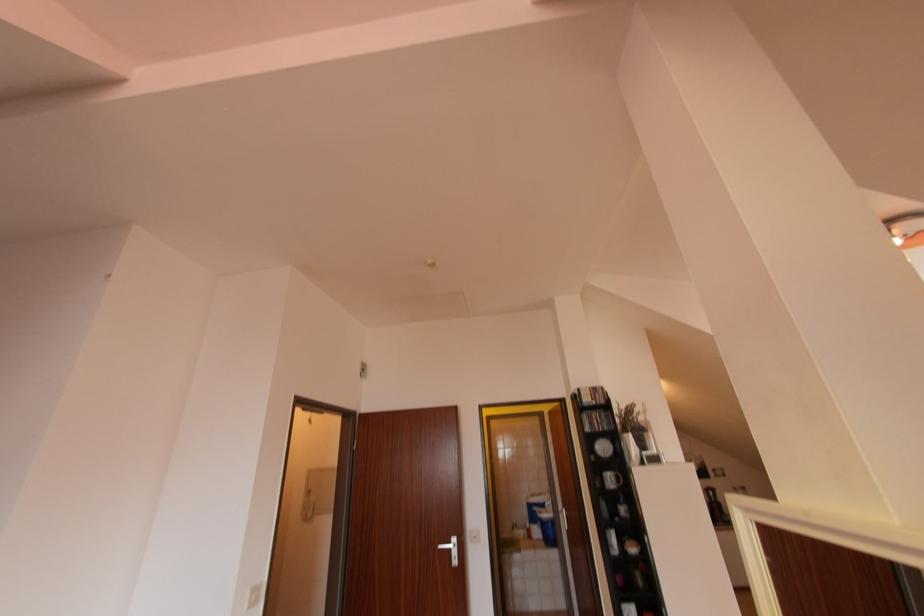
Where would you push the white light switch? Please return your answer as a coordinate pair (x, y).

(253, 594)